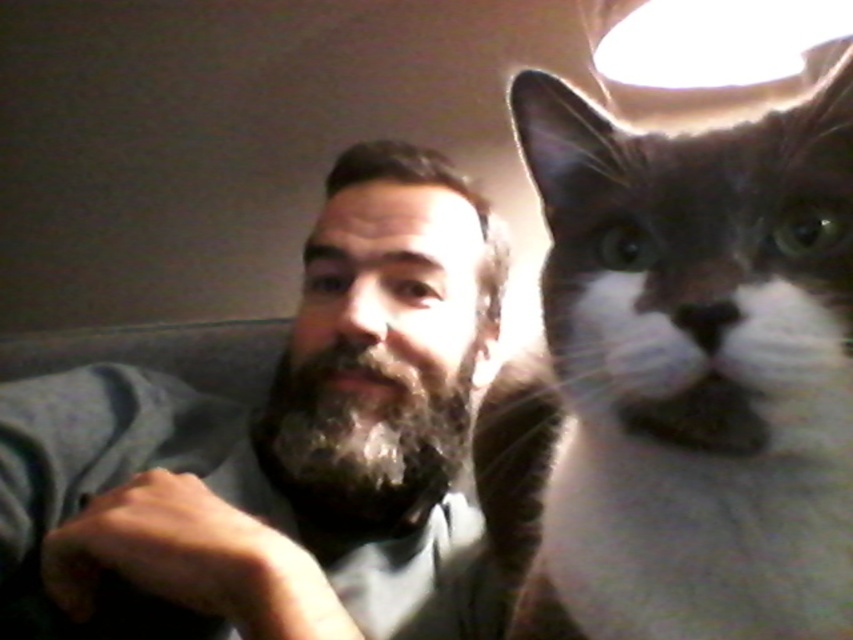
You are taking a photo of two points in the scene. The first point is labeled as point (x=766, y=202) and the second is point (x=379, y=586). Which point is closer to the camera?

Point (x=766, y=202) is closer to the camera than point (x=379, y=586).